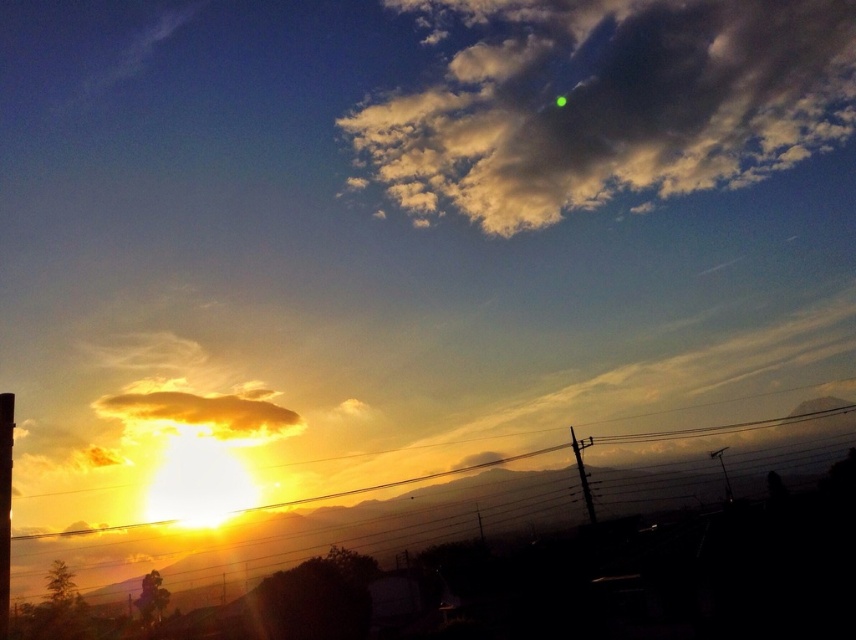
You are an artist trying to capture this sunset scene. You notice the metallic wire at lower left and the golden yellow fluffy cloud at lower left in your viewfinder. Which object is positioned further to the left?

The golden yellow fluffy cloud at lower left is positioned further to the left since the metallic wire at lower left is to the right of it.

You are a photographer trying to capture the sunset scene. You want to place your camera such that the metallic wire at lower left is exactly at the center of your viewfinder. What coordinates should you aim for?

You should aim for the coordinates point (372, 524) to center the metallic wire at lower left in your viewfinder.